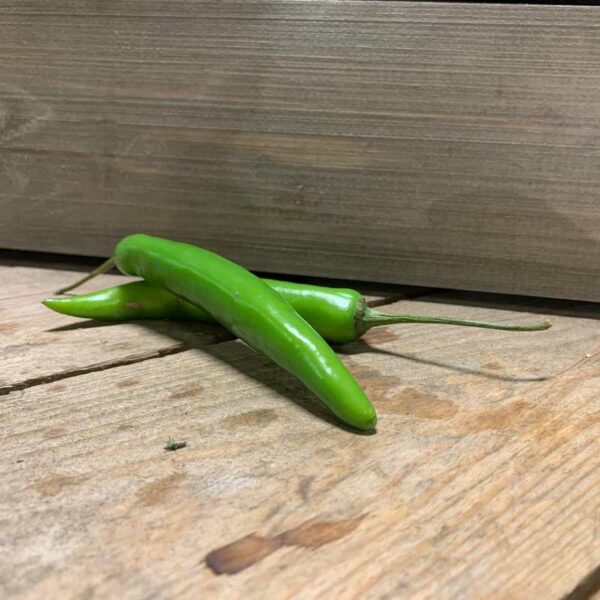
The height and width of the screenshot is (600, 600). In order to click on brown spots on table in this screenshot , I will do `click(238, 562)`, `click(312, 536)`, `click(254, 413)`, `click(190, 383)`, `click(134, 383)`, `click(376, 382)`, `click(495, 421)`, `click(390, 338)`.